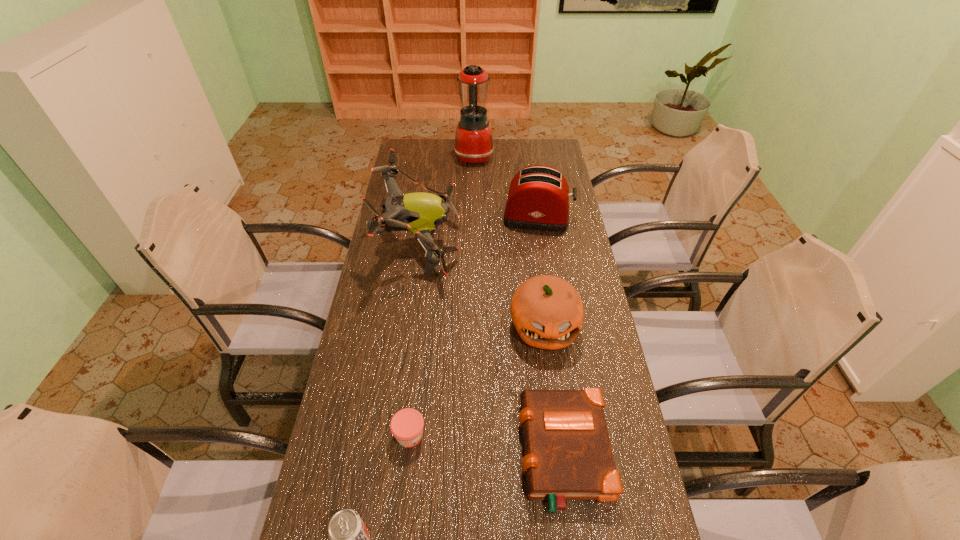
In order to click on the farthest object in this screenshot , I will do `click(474, 143)`.

This screenshot has width=960, height=540. In order to click on food processor in this screenshot , I will do `click(474, 143)`.

Identify the location of drone. (419, 212).

This screenshot has width=960, height=540. What are the coordinates of `toaster` in the screenshot? It's located at (538, 199).

This screenshot has width=960, height=540. What are the coordinates of `the fourth nearest object` in the screenshot? It's located at (547, 311).

Find the location of `Bible`. Bible is located at coordinates (567, 453).

This screenshot has width=960, height=540. Find the location of `jam`. jam is located at coordinates (406, 425).

Image resolution: width=960 pixels, height=540 pixels. Find the location of `free space located on the controls of the farthest object`. free space located on the controls of the farthest object is located at coordinates (516, 156).

Identify the location of free space located 0.190m on the front-facing side of the drone. Image resolution: width=960 pixels, height=540 pixels. (510, 242).

You are a GUI agent. You are given a task and a screenshot of the screen. Output one action in this format:
    pyautogui.click(x=<x>, y=<y>)
    Task: Click on the free space located on the front of the toaster
    The image size is (960, 540).
    Given the screenshot: What is the action you would take?
    pyautogui.click(x=543, y=254)